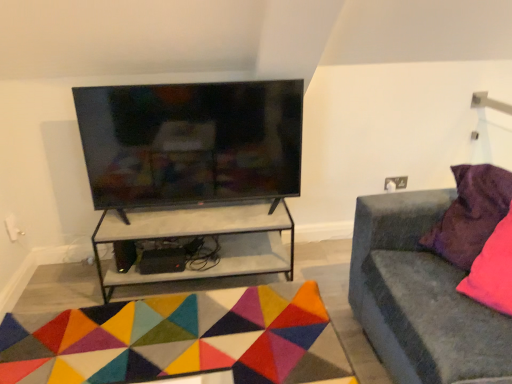
This screenshot has width=512, height=384. In order to click on vacant space underneath black glossy tv at upper center (from a real-world perspective) in this screenshot , I will do `click(198, 207)`.